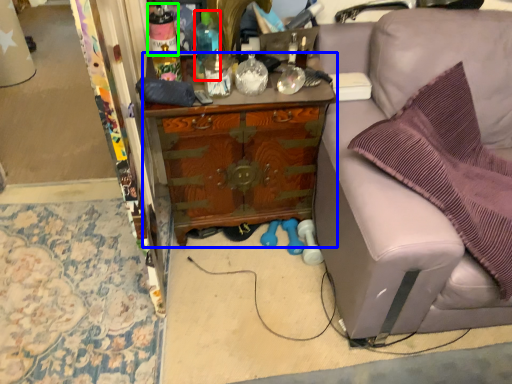
Question: Based on their relative distances, which object is nearer to bottle (highlighted by a red box)? Choose from cabinetry (highlighted by a blue box) and bottle (highlighted by a green box).

Choices:
 (A) cabinetry
 (B) bottle

Answer: (B)